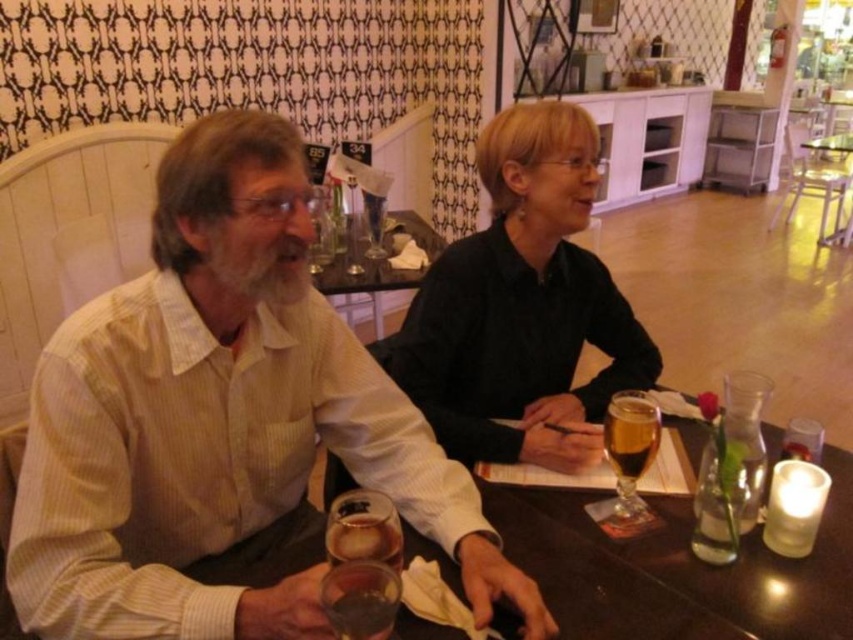
Question: Which object appears closest to the camera in this image?

Choices:
 (A) smooth wooden table at center
 (B) amber glass beer at center
 (C) clear glass wine glass at upper center
 (D) translucent glass wine glass at center

Answer: (D)

Question: Is black matte shirt at center below clear glass wine glass at upper center?

Choices:
 (A) yes
 (B) no

Answer: (A)

Question: Is white striped shirt at left positioned behind clear glass wine glass at upper center?

Choices:
 (A) yes
 (B) no

Answer: (B)

Question: Which of the following is the farthest from the observer?

Choices:
 (A) (390, 556)
 (B) (602, 438)
 (C) (509, 381)
 (D) (221, 355)

Answer: (C)

Question: Is black matte shirt at center positioned before translucent glass wine glass at center?

Choices:
 (A) no
 (B) yes

Answer: (A)

Question: Among these objects, which one is farthest from the camera?

Choices:
 (A) amber glass beer at center
 (B) translucent glass wine glass at center
 (C) black matte shirt at center
 (D) smooth wooden table at center

Answer: (C)